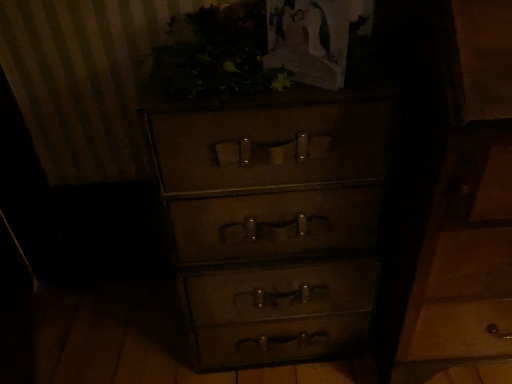
Question: Considering the relative sizes of green leafy plant at upper center and matte brown chest of drawers at center in the image provided, is green leafy plant at upper center shorter than matte brown chest of drawers at center?

Choices:
 (A) yes
 (B) no

Answer: (A)

Question: Is green leafy plant at upper center looking in the opposite direction of matte brown chest of drawers at center?

Choices:
 (A) yes
 (B) no

Answer: (B)

Question: Considering the relative sizes of green leafy plant at upper center and matte brown chest of drawers at center in the image provided, is green leafy plant at upper center wider than matte brown chest of drawers at center?

Choices:
 (A) yes
 (B) no

Answer: (B)

Question: Is green leafy plant at upper center at the right side of matte brown chest of drawers at center?

Choices:
 (A) yes
 (B) no

Answer: (B)

Question: Is green leafy plant at upper center with matte brown chest of drawers at center?

Choices:
 (A) yes
 (B) no

Answer: (B)

Question: Is the position of green leafy plant at upper center more distant than that of matte brown chest of drawers at center?

Choices:
 (A) yes
 (B) no

Answer: (B)

Question: Considering the relative sizes of matte brown chest of drawers at center and green leafy plant at upper center in the image provided, is matte brown chest of drawers at center taller than green leafy plant at upper center?

Choices:
 (A) no
 (B) yes

Answer: (B)

Question: Is matte brown chest of drawers at center not close to green leafy plant at upper center?

Choices:
 (A) yes
 (B) no

Answer: (B)

Question: Is matte brown chest of drawers at center thinner than green leafy plant at upper center?

Choices:
 (A) no
 (B) yes

Answer: (A)

Question: Is matte brown chest of drawers at center shorter than green leafy plant at upper center?

Choices:
 (A) yes
 (B) no

Answer: (B)

Question: From the image's perspective, is matte brown chest of drawers at center beneath green leafy plant at upper center?

Choices:
 (A) yes
 (B) no

Answer: (A)

Question: Is matte brown chest of drawers at center smaller than green leafy plant at upper center?

Choices:
 (A) yes
 (B) no

Answer: (B)

Question: Considering their positions, is green leafy plant at upper center located in front of or behind matte brown chest of drawers at center?

Choices:
 (A) front
 (B) behind

Answer: (A)